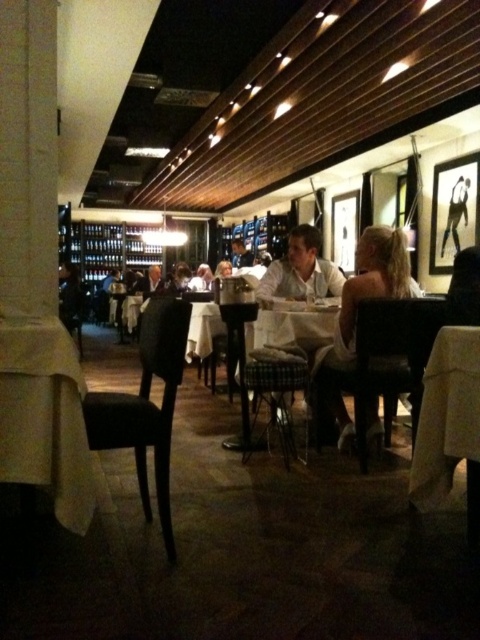
You are a server in the restaurant and need to place a 10cm wide tray between the white linen table at lower left and the matte black suit at center. Can the tray fit sideways?

The white linen table at lower left is thinner than the matte black suit at center. Since the tray is 10cm wide, it depends on the available space between them. However, without specific measurements of the gap, we cannot definitively determine if the tray will fit. Please measure the space before placing the tray.